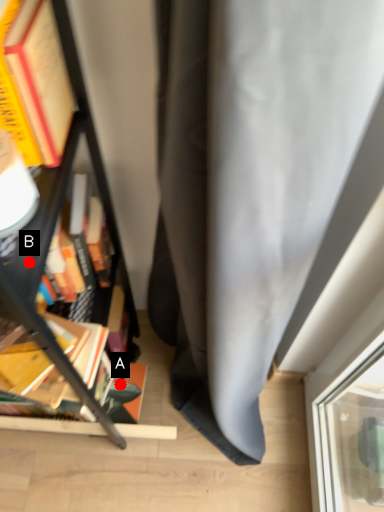
Question: Two points are circled on the image, labeled by A and B beside each circle. Among these points, which one is farthest from the camera?

Choices:
 (A) A is further
 (B) B is further

Answer: (A)